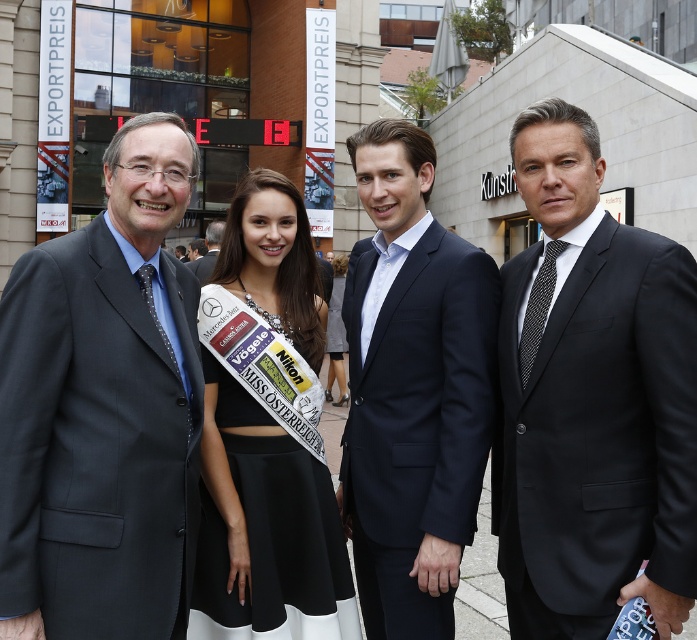
Is dark blue suit at left thinner than white satin sash at center?

Yes, dark blue suit at left is thinner than white satin sash at center.

Between dark blue suit at left and white satin sash at center, which one has more height?

dark blue suit at left is taller.

Where is `dark blue suit at left`? The image size is (697, 640). dark blue suit at left is located at coordinates (99, 412).

Between dark blue suit at left and navy wool suit at center, which one has less height?

With less height is navy wool suit at center.

Is point (75, 474) closer to camera compared to point (436, 243)?

Yes.

The width and height of the screenshot is (697, 640). I want to click on dark blue suit at left, so click(99, 412).

Who is taller, black satin suit at right or dark blue suit at left?

Standing taller between the two is black satin suit at right.

Who is positioned more to the left, black satin suit at right or dark blue suit at left?

dark blue suit at left

Image resolution: width=697 pixels, height=640 pixels. Identify the location of black satin suit at right. (590, 401).